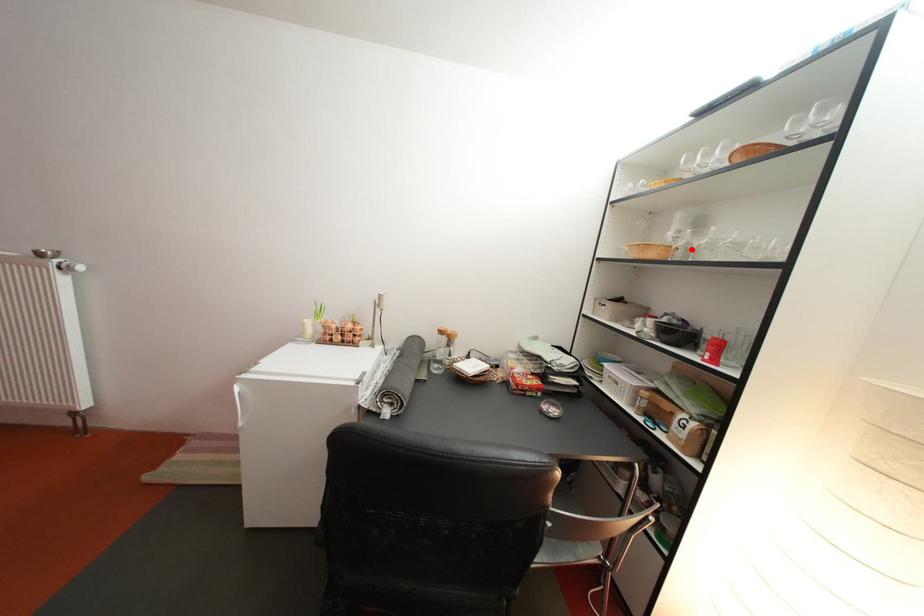
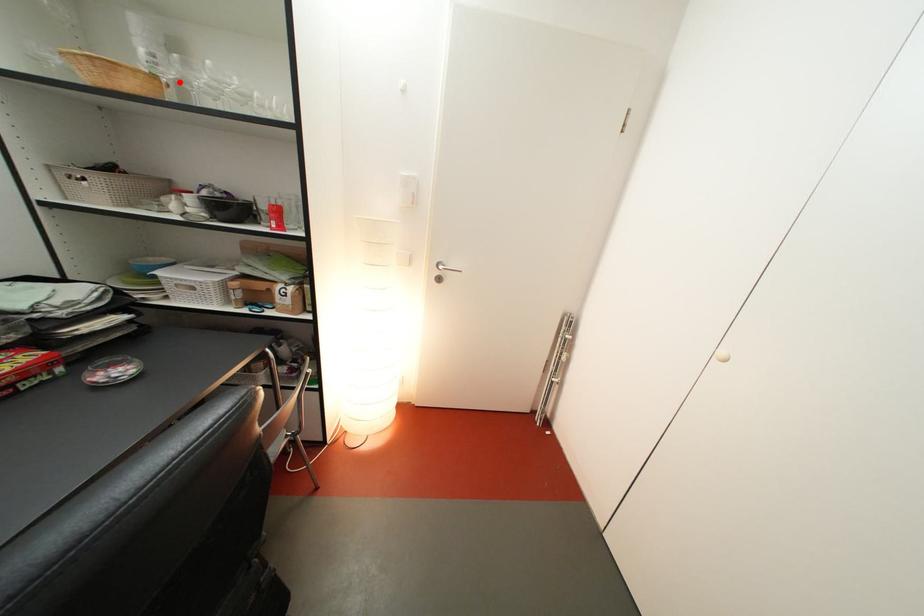
I am providing you with two images of the same scene from different viewpoints. A red point is marked on the first image and another point is marked on the second image. Is the red point in image1 aligned with the point shown in image2?

Yes